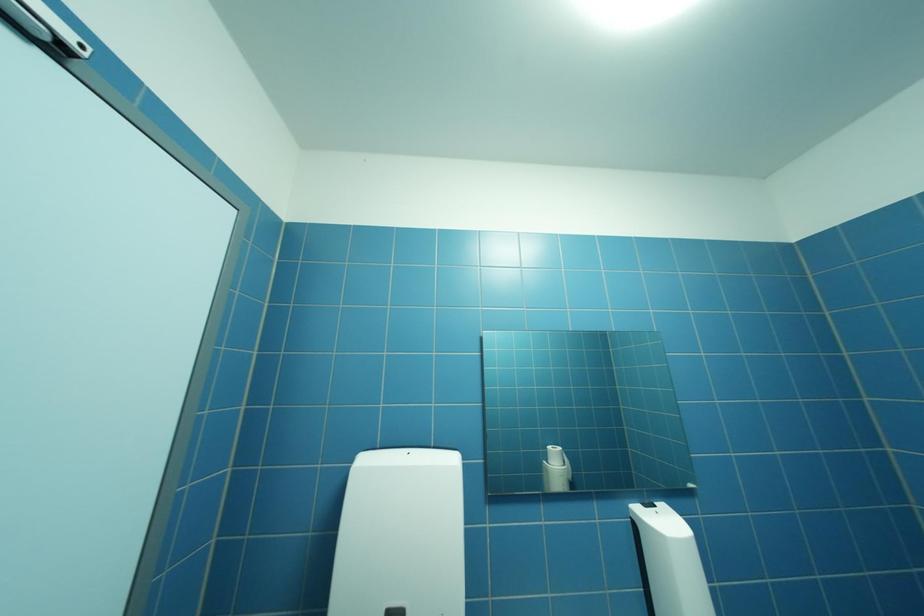
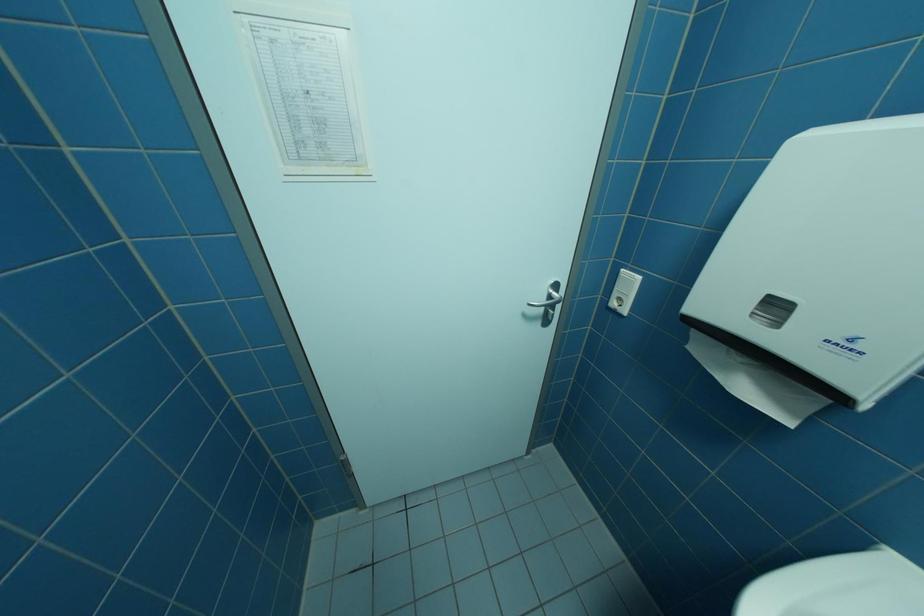
First-person continuous shooting, in which direction is the camera rotating?

The rotation direction of the camera is left-down.